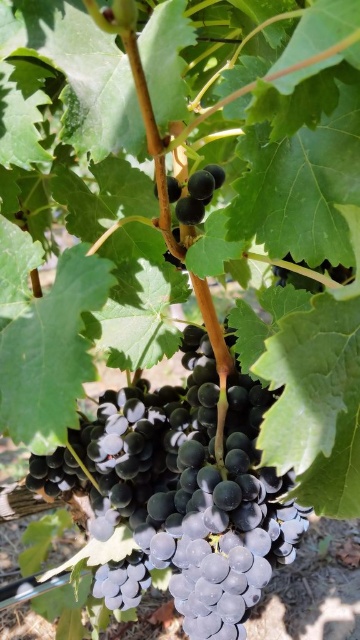
Question: Is shiny purple grapes at center wider than shiny dark purple grape at center?

Choices:
 (A) no
 (B) yes

Answer: (B)

Question: Can you confirm if shiny purple grapes at center is smaller than shiny dark purple grape at center?

Choices:
 (A) yes
 (B) no

Answer: (B)

Question: Which of the following is the closest to the observer?

Choices:
 (A) (186, 442)
 (B) (182, 204)

Answer: (B)

Question: In this image, where is shiny purple grapes at center located relative to shiny dark purple grape at center?

Choices:
 (A) below
 (B) above

Answer: (A)

Question: Among these points, which one is nearest to the camera?

Choices:
 (A) (195, 212)
 (B) (263, 508)

Answer: (A)